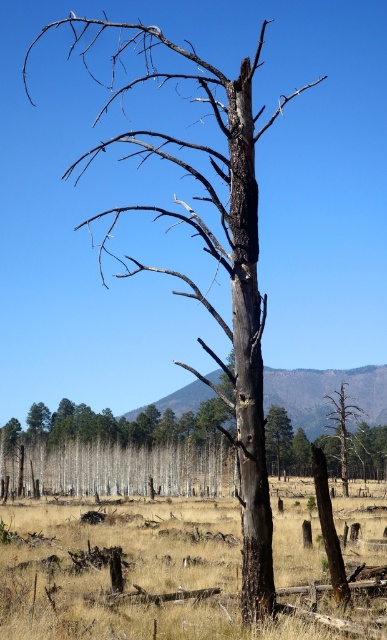
You are a hiker who needs to navigate through the dry grass at center and the charred wood tree at center. Which object is taller and should be avoided to prevent tripping?

The charred wood tree at center is taller than the dry grass at center, so you should avoid the charred wood tree at center to prevent tripping.